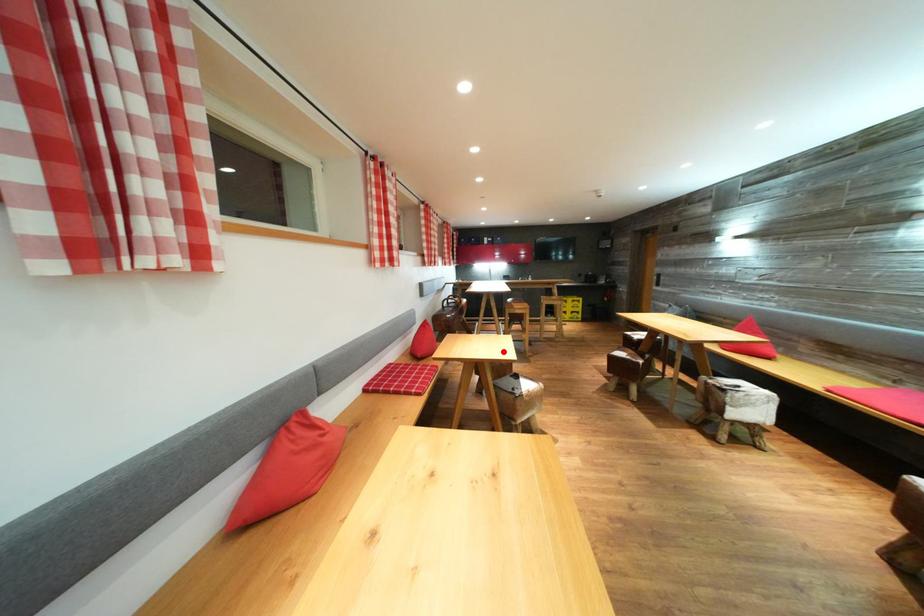
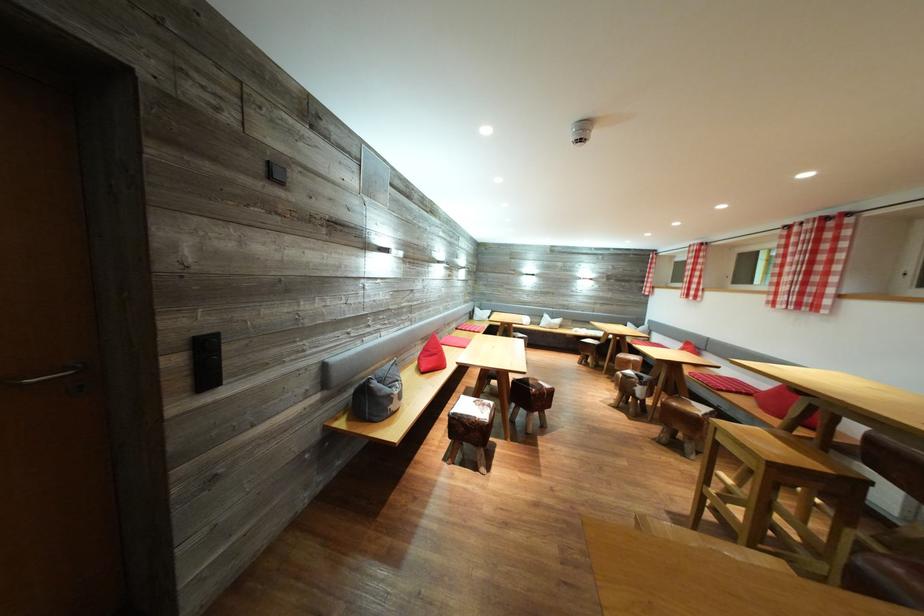
Question: I am providing you with two images of the same scene from different viewpoints. A red point is marked on the first image. Is the red point's position out of view in image 2?

Choices:
 (A) Yes
 (B) No

Answer: (A)